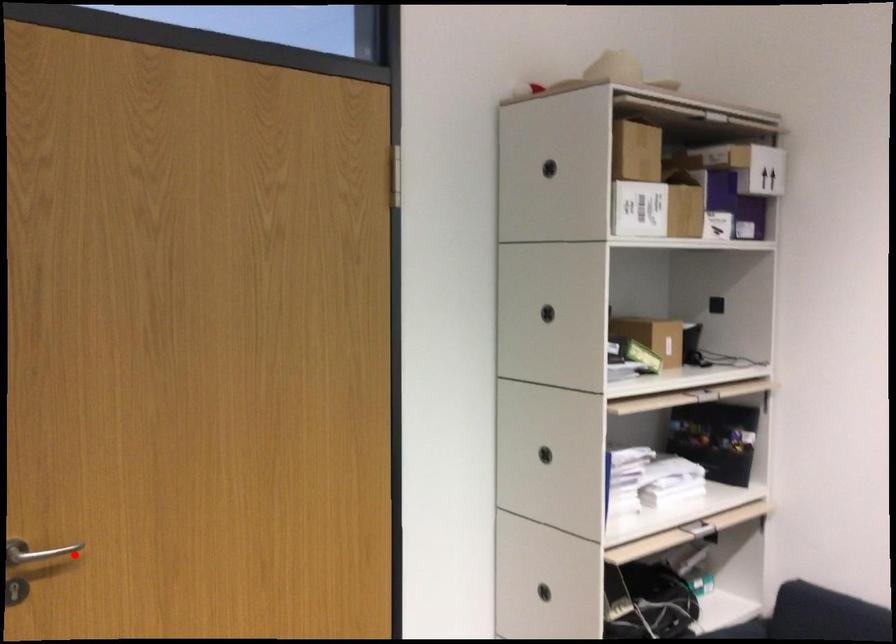
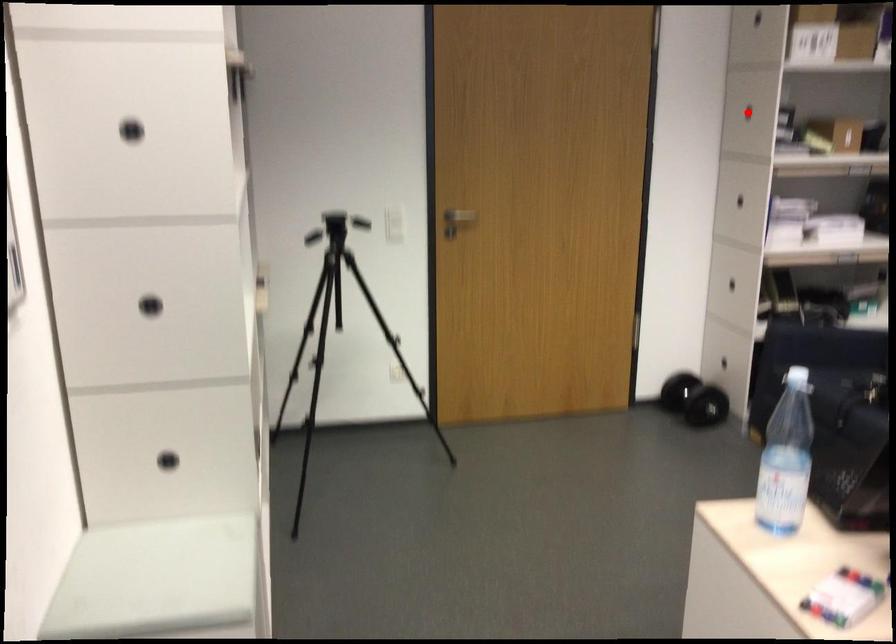
I am providing you with two images of the same scene from different viewpoints. A red point is marked on the first image and another point is marked on the second image. Is the red point in image1 aligned with the point shown in image2?

No